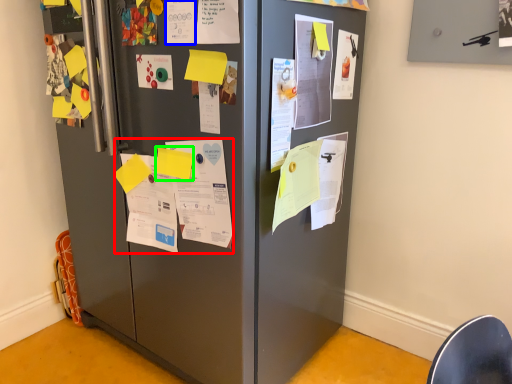
Question: Estimate the real-world distances between objects in this image. Which object is farther from poster (highlighted by a red box), poster (highlighted by a blue box) or paper (highlighted by a green box)?

Choices:
 (A) poster
 (B) paper

Answer: (A)